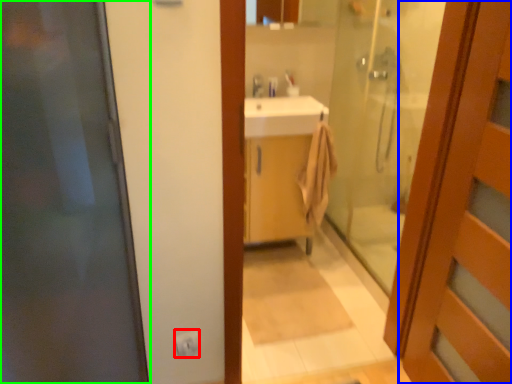
Question: Estimate the real-world distances between objects in this image. Which object is closer to electric outlet (highlighted by a red box), door (highlighted by a blue box) or door (highlighted by a green box)?

Choices:
 (A) door
 (B) door

Answer: (B)